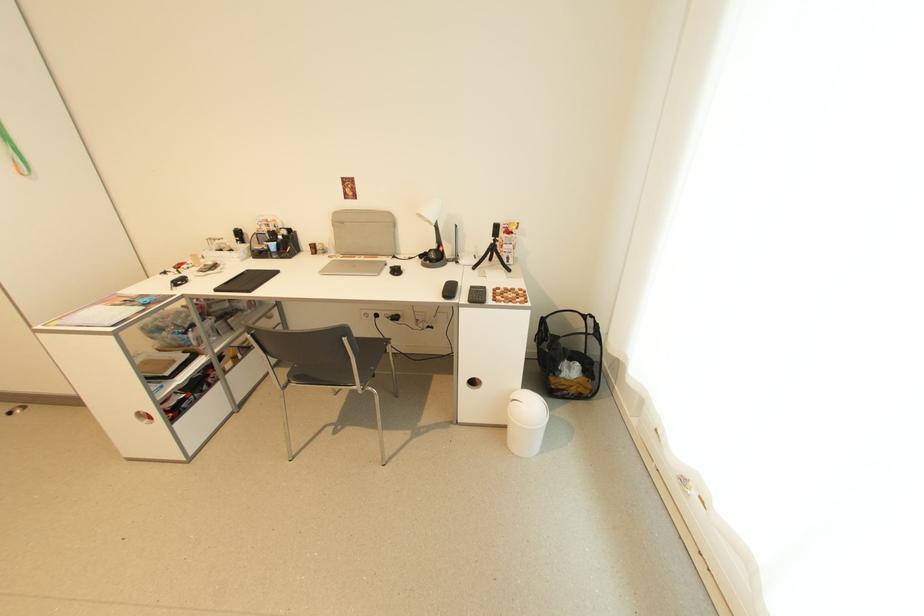
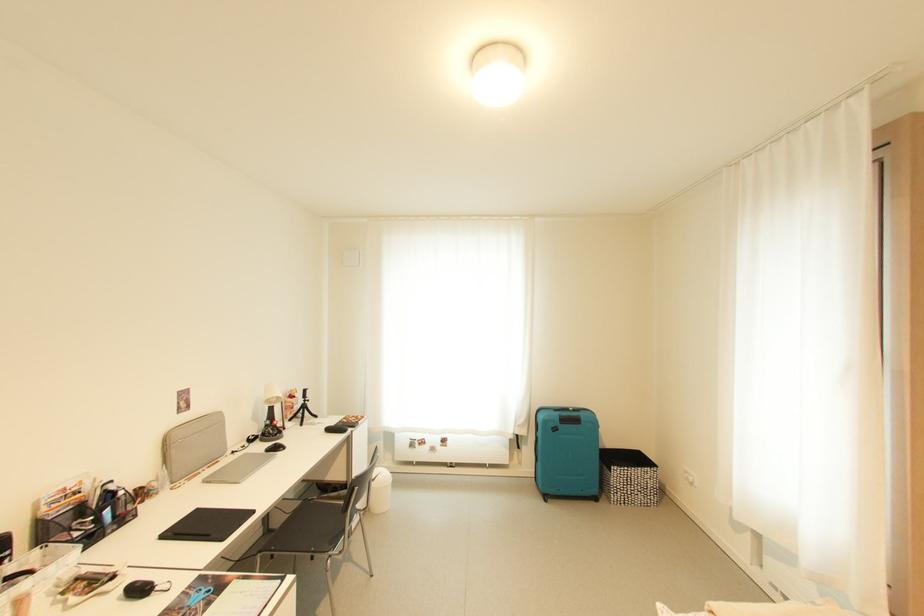
The point at [456,256] is marked in the first image. Where is the corresponding point in the second image?

(262, 434)